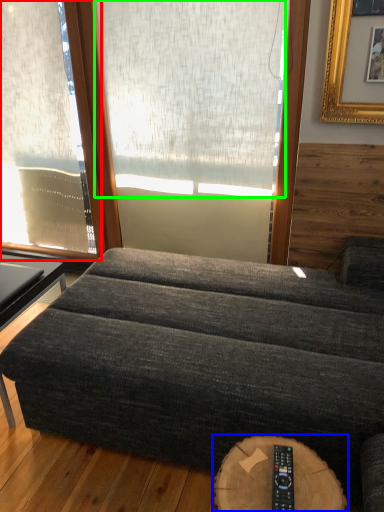
Question: Considering the real-world distances, which object is closest to window (highlighted by a red box)? round table (highlighted by a blue box) or window screen (highlighted by a green box).

Choices:
 (A) round table
 (B) window screen

Answer: (B)